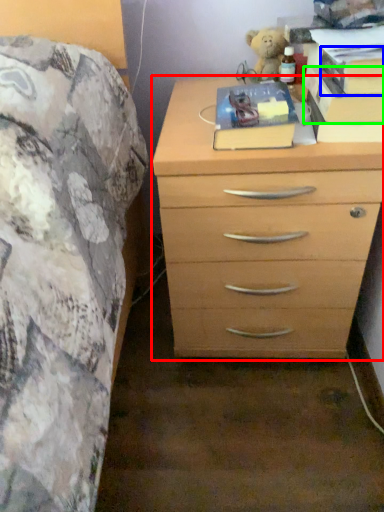
Question: Which object is positioned closest to chest of drawers (highlighted by a red box)? Select from paperback book (highlighted by a blue box) and paperback book (highlighted by a green box).

Choices:
 (A) paperback book
 (B) paperback book

Answer: (B)